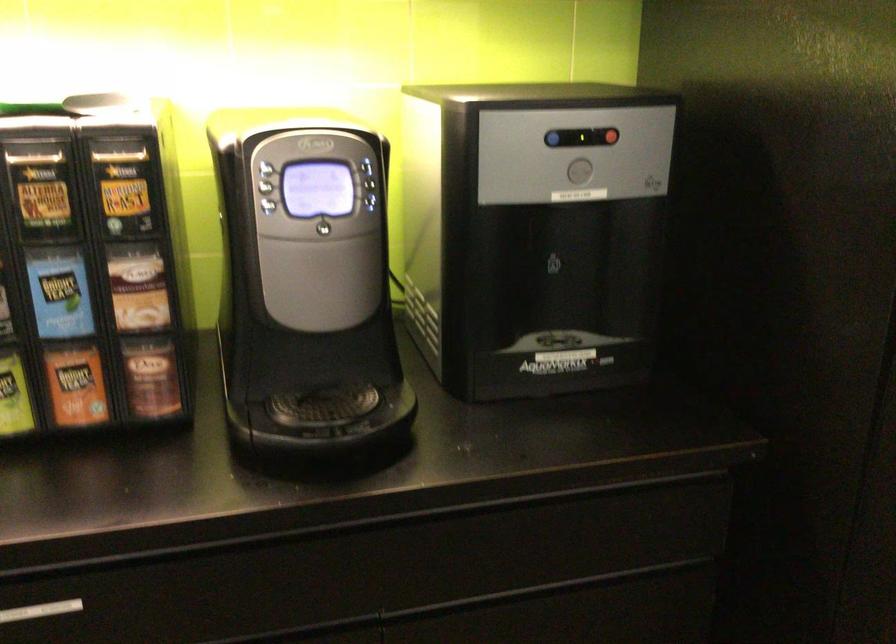
The image size is (896, 644). I want to click on gray dispenser button, so click(579, 172).